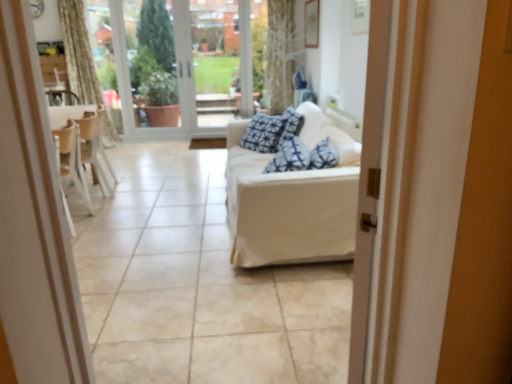
Question: Is transparent glass door at center in front of white fabric couch at center?

Choices:
 (A) yes
 (B) no

Answer: (B)

Question: Considering the relative positions of transparent glass door at center and white fabric couch at center in the image provided, is transparent glass door at center to the right of white fabric couch at center from the viewer's perspective?

Choices:
 (A) no
 (B) yes

Answer: (B)

Question: From a real-world perspective, is transparent glass door at center over white fabric couch at center?

Choices:
 (A) yes
 (B) no

Answer: (A)

Question: Are transparent glass door at center and white fabric couch at center located far from each other?

Choices:
 (A) no
 (B) yes

Answer: (B)

Question: Considering the relative sizes of transparent glass door at center and white fabric couch at center in the image provided, is transparent glass door at center shorter than white fabric couch at center?

Choices:
 (A) yes
 (B) no

Answer: (B)

Question: From the image's perspective, is white fabric couch at center located above or below transparent glass door at center?

Choices:
 (A) below
 (B) above

Answer: (A)

Question: In the image, is white fabric couch at center on the left side or the right side of transparent glass door at center?

Choices:
 (A) right
 (B) left

Answer: (B)

Question: Considering their positions, is white fabric couch at center located in front of or behind transparent glass door at center?

Choices:
 (A) front
 (B) behind

Answer: (A)

Question: In terms of width, does white fabric couch at center look wider or thinner when compared to transparent glass door at center?

Choices:
 (A) thin
 (B) wide

Answer: (B)

Question: Is white fabric couch at center bigger or smaller than transparent glass door at center?

Choices:
 (A) small
 (B) big

Answer: (B)

Question: From a real-world perspective, is white fabric couch at center positioned above or below transparent glass door at center?

Choices:
 (A) below
 (B) above

Answer: (A)

Question: Is point (263, 195) closer or farther from the camera than point (202, 57)?

Choices:
 (A) closer
 (B) farther

Answer: (A)

Question: Is white fabric couch at center in front of or behind transparent glass door at center in the image?

Choices:
 (A) behind
 (B) front

Answer: (B)

Question: In terms of height, does white fabric couch at center look taller or shorter compared to white glass door at upper center?

Choices:
 (A) short
 (B) tall

Answer: (A)

Question: Is white fabric couch at center spatially inside white glass door at upper center, or outside of it?

Choices:
 (A) inside
 (B) outside

Answer: (B)